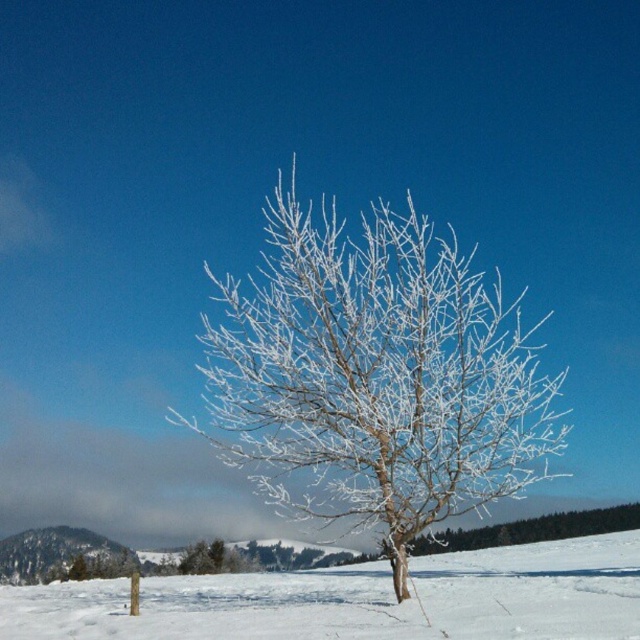
You are an artist planning to paint the winter scene. You need to decide where to place the frosted white tree at center and the white frosty snow at center in your painting. According to the scene, which object should be placed to the left of the other?

The frosted white tree at center is positioned on the left side of white frosty snow at center, so the frosted white tree at center should be placed to the left of the white frosty snow at center in the painting.

You are an artist trying to paint this winter scene. You want to ensure the frosted white tree at center and the white frosty snow at center are proportionally accurate. Which object should you paint to be wider?

The white frosty snow at center should be painted wider because the frosted white tree at center has a lesser width compared to white frosty snow at center.

You are a photographer planning to capture the frosted white tree at center and the white frosty snow at center in a single shot. Based on their positions, which object will appear closer to the camera in the photo?

The frosted white tree at center is positioned over white frosty snow at center, so it will appear closer to the camera in the photo.